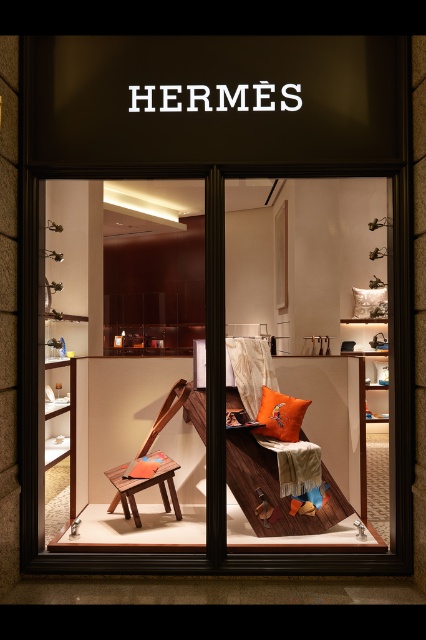
Does wooden bench at center lie behind wooden chair at center?

Yes.

Who is more forward, [296,182] or [186,401]?

Positioned in front is point [186,401].

Identify the location of wooden bench at center. (305, 314).

Is wooden bench at center taller than orange fabric pillow at center?

No, wooden bench at center is not taller than orange fabric pillow at center.

Can you confirm if wooden bench at center is smaller than orange fabric pillow at center?

Yes.

Is point (267, 289) farther from camera compared to point (258, 412)?

Yes, it is behind point (258, 412).

The height and width of the screenshot is (640, 426). I want to click on wooden bench at center, so click(305, 314).

Which is more to the left, wooden stool at center or orange fabric pillow at center?

From the viewer's perspective, wooden stool at center appears more on the left side.

Does wooden stool at center have a lesser width compared to orange fabric pillow at center?

No.

The image size is (426, 640). In order to click on wooden stool at center in this screenshot , I will do `click(143, 486)`.